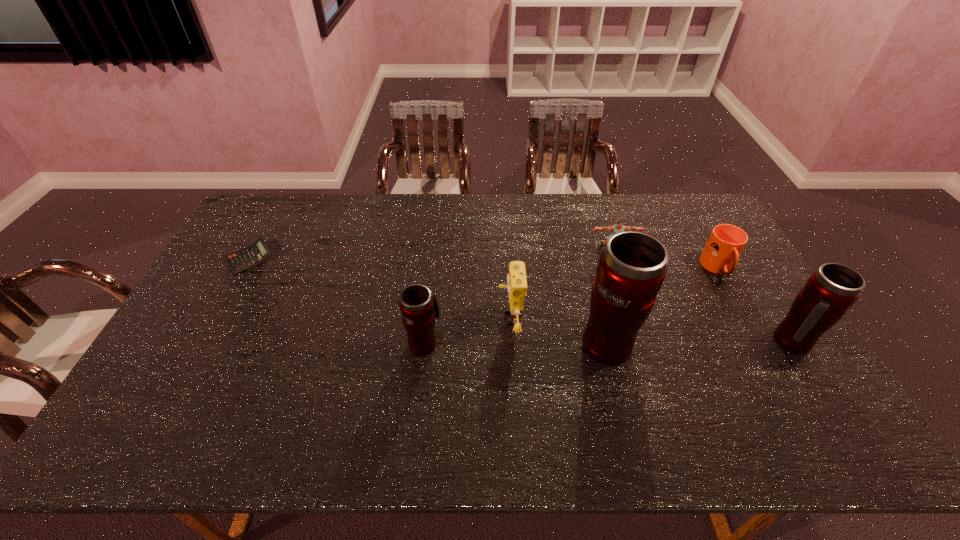
At what (x,y) coordinates should I click in order to perform the action: click on vacant region located on the front-facing side of the puncher. Please return your answer as a coordinate pair (x, y). Looking at the image, I should click on (626, 291).

This screenshot has width=960, height=540. In order to click on free space located 0.160m on the face of the third object from left to right in this screenshot , I will do `click(443, 319)`.

The image size is (960, 540). Identify the location of vacant space located 0.230m on the face of the third object from left to right. (418, 319).

Image resolution: width=960 pixels, height=540 pixels. I want to click on vacant space located 0.180m on the face of the third object from left to right, so click(435, 319).

Where is `object positioned at the left edge`? The width and height of the screenshot is (960, 540). object positioned at the left edge is located at coordinates (245, 259).

The image size is (960, 540). Identify the location of thermos bottle at the right edge. (830, 291).

Locate an element on the screen. mug that is positioned at the right edge is located at coordinates (721, 253).

In the image, there is a desktop. Where is `vacant space at the far edge`? This screenshot has height=540, width=960. vacant space at the far edge is located at coordinates (485, 195).

Locate an element on the screen. The width and height of the screenshot is (960, 540). vacant space at the near edge of the desktop is located at coordinates (356, 380).

The height and width of the screenshot is (540, 960). In the image, there is a desktop. In order to click on vacant space at the left edge in this screenshot , I will do `click(214, 286)`.